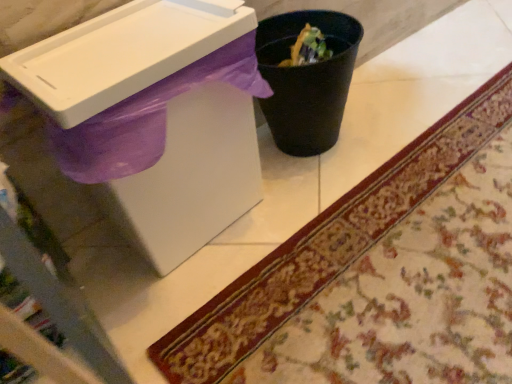
Image resolution: width=512 pixels, height=384 pixels. What are the coordinates of `unoccupied region to the right of white plastic sink at upper left` in the screenshot? It's located at (332, 209).